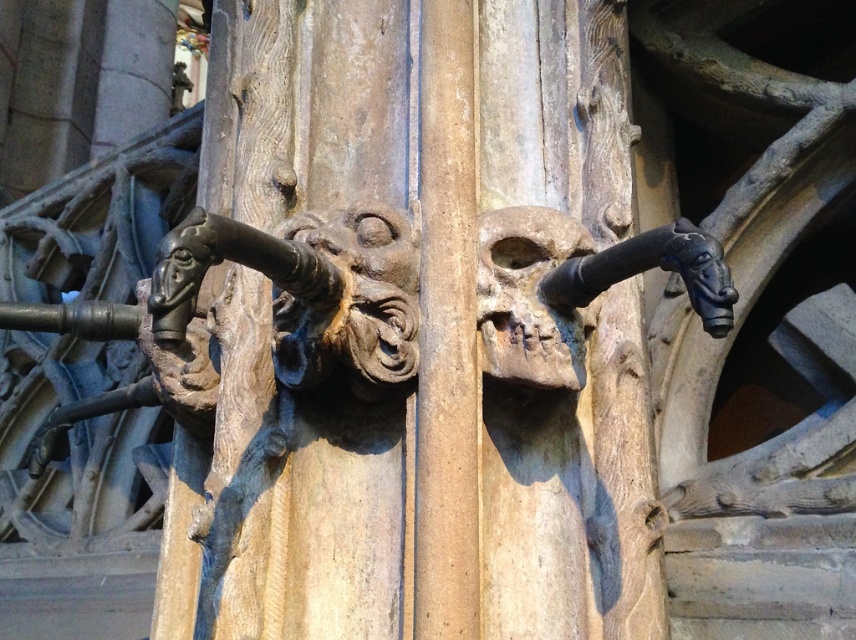
Measure the distance between brown stone skull at center and camera.

77.03 centimeters

Between brown stone skull at center and black metal/bronze at upper center, which one is positioned lower?

Positioned lower is brown stone skull at center.

Between point (544, 339) and point (704, 300), which one is positioned in front?

Point (704, 300) is in front.

You are a GUI agent. You are given a task and a screenshot of the screen. Output one action in this format:
    pyautogui.click(x=<x>, y=<y>)
    Task: Click on the brown stone skull at center
    
    Given the screenshot: What is the action you would take?
    pyautogui.click(x=528, y=296)